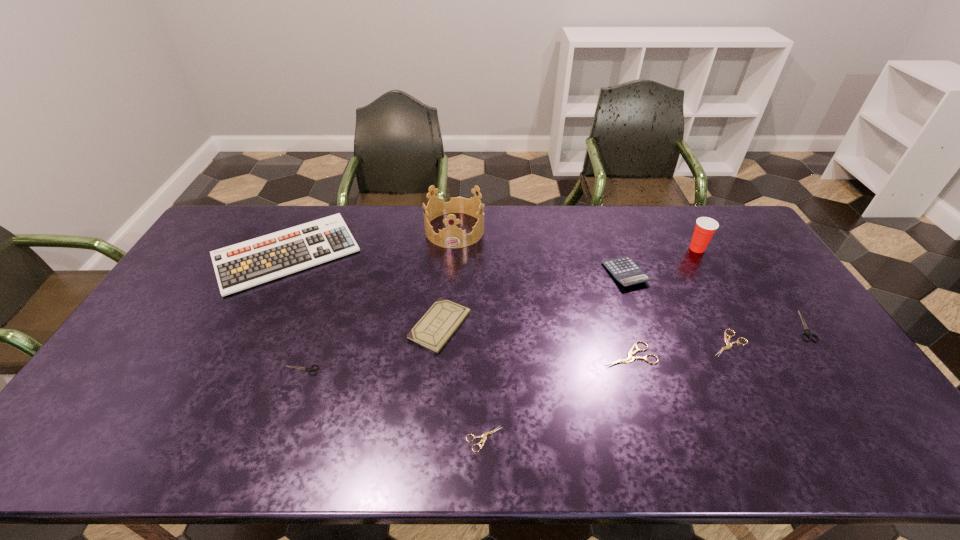
Locate an element on the screen. The width and height of the screenshot is (960, 540). vacant space at the near right corner of the desktop is located at coordinates (853, 426).

Find the location of a particular element. This screenshot has width=960, height=540. free spot between the leftmost shears and the fourth shears from right to left is located at coordinates (393, 404).

Find the location of `free space that is in between the nearest object and the computer keyboard`. free space that is in between the nearest object and the computer keyboard is located at coordinates (386, 347).

Locate an element on the screen. vacant area that lies between the rightmost shears and the second smallest beige shears is located at coordinates (765, 335).

I want to click on empty space that is in between the calculator and the rightmost object, so click(x=713, y=300).

Identify the location of free space that is in between the farther black shears and the fifth tallest object. (621, 326).

Locate an element on the screen. This screenshot has height=540, width=960. vacant area that lies between the second smallest beige shears and the biggest beige shears is located at coordinates (679, 349).

Where is `unoccupied position between the shortest object and the checkbook`? unoccupied position between the shortest object and the checkbook is located at coordinates (462, 382).

The image size is (960, 540). In order to click on free space between the third shears from right to left and the left black shears in this screenshot , I will do `click(465, 362)`.

I want to click on empty location between the nearer black shears and the right black shears, so click(552, 348).